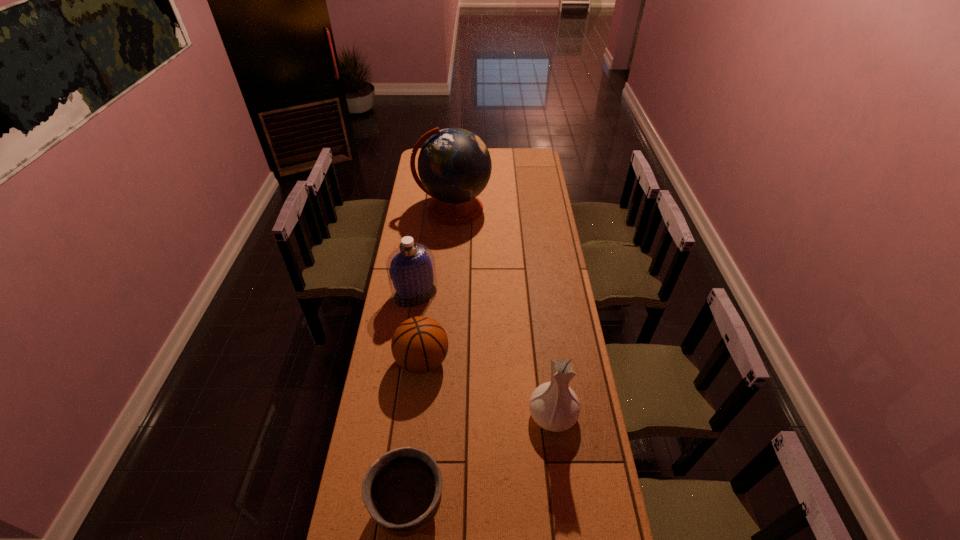
Find the location of a particular element. the tallest object is located at coordinates (454, 165).

Identify the location of globe. This screenshot has width=960, height=540. (454, 165).

Identify the location of the second farthest object. This screenshot has width=960, height=540. (411, 271).

Locate an element on the screen. The height and width of the screenshot is (540, 960). vase is located at coordinates (554, 406).

The height and width of the screenshot is (540, 960). Identify the location of the rightmost object. pos(554,406).

At what (x,y) coordinates should I click in order to perform the action: click on the fourth tallest object. Please return your answer as a coordinate pair (x, y). The width and height of the screenshot is (960, 540). Looking at the image, I should click on (419, 345).

Find the location of `the third nearest object`. the third nearest object is located at coordinates (419, 345).

The width and height of the screenshot is (960, 540). Find the location of `free space located with the Americas facing the viewer on the tallest object`. free space located with the Americas facing the viewer on the tallest object is located at coordinates (451, 241).

Where is `vacant space located 0.240m on the back of the fourth nearest object`? The width and height of the screenshot is (960, 540). vacant space located 0.240m on the back of the fourth nearest object is located at coordinates (421, 246).

The height and width of the screenshot is (540, 960). What are the coordinates of `free region located 0.400m on the back of the rightmost object` in the screenshot? It's located at (540, 310).